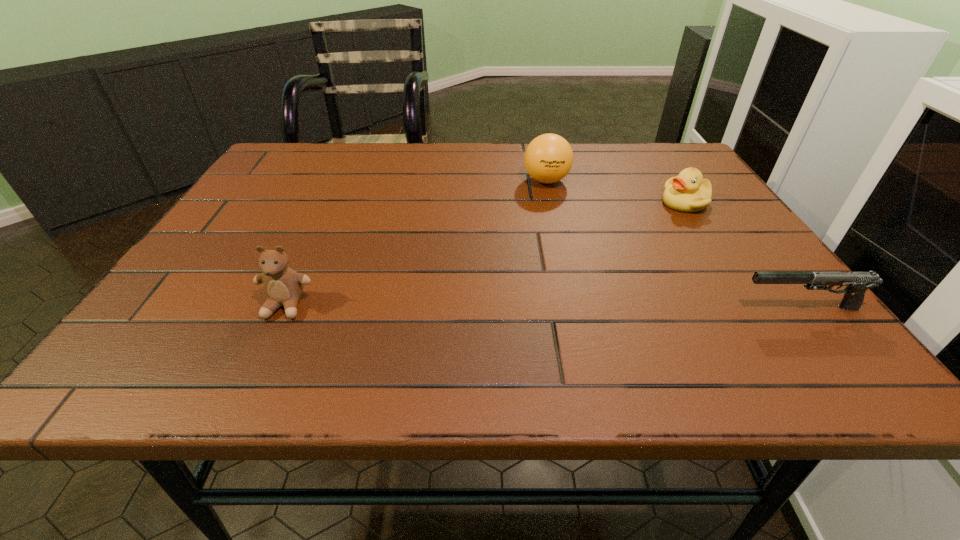
Locate an element on the screen. free space on the desktop that is between the teddy bear and the gun and is positioned at the face of the duckling is located at coordinates (528, 307).

Find the location of a particular element. This screenshot has height=540, width=960. free space on the desktop that is between the leftmost object and the gun and is positioned on the side with brand of the second object from left to right is located at coordinates (499, 307).